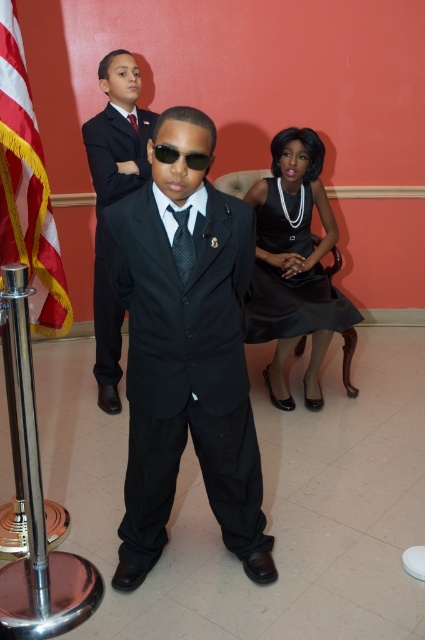
Who is taller, matte black suit at center or black textured tie at center?

matte black suit at center is taller.

Does matte black suit at center have a lesser width compared to black textured tie at center?

In fact, matte black suit at center might be wider than black textured tie at center.

Between point (121, 268) and point (130, 118), which one is positioned in front?

Point (121, 268) is in front.

Find the location of a particular element. matte black suit at center is located at coordinates (186, 355).

Does black satin dress at center appear under black reflective sunglasses at center?

Indeed, black satin dress at center is positioned under black reflective sunglasses at center.

Can you confirm if black satin dress at center is smaller than black reflective sunglasses at center?

Actually, black satin dress at center might be larger than black reflective sunglasses at center.

Between point (325, 298) and point (158, 154), which one is positioned in front?

Point (158, 154) is in front.

Locate an element on the screen. This screenshot has width=425, height=640. black satin dress at center is located at coordinates (294, 305).

Is point (223, 300) more distant than point (8, 230)?

No.

Looking at this image, is matte black suit at center bigger than red-white striped flag at left?

Yes.

Who is more forward, (186,392) or (36,296)?

Point (186,392)

This screenshot has height=640, width=425. I want to click on matte black suit at center, so click(186, 355).